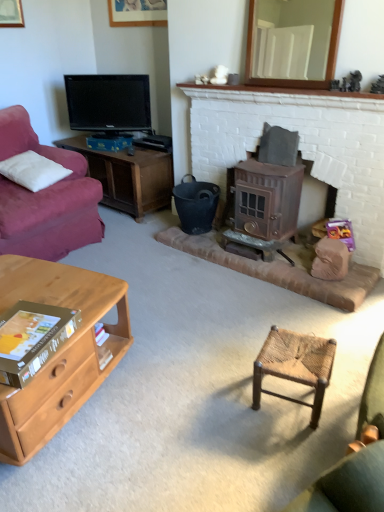
You are a GUI agent. You are given a task and a screenshot of the screen. Output one action in this format:
    pyautogui.click(x=<x>, y=<y>)
    Task: Click on the vacant space situated above gold cardboard book at lower left (from a real-world perspective)
    This screenshot has width=384, height=512.
    Given the screenshot: What is the action you would take?
    pyautogui.click(x=29, y=332)